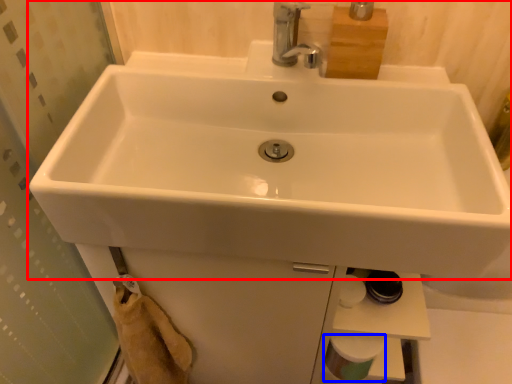
Question: Which object appears farthest to the camera in this image, sink (highlighted by a red box) or toilet paper (highlighted by a blue box)?

Choices:
 (A) sink
 (B) toilet paper

Answer: (B)